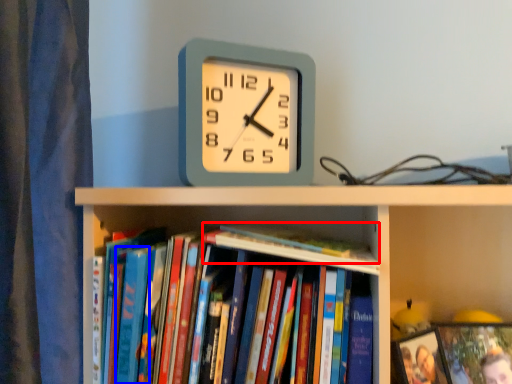
Question: Among these objects, which one is farthest to the camera, book (highlighted by a red box) or paperback book (highlighted by a blue box)?

Choices:
 (A) book
 (B) paperback book

Answer: (B)